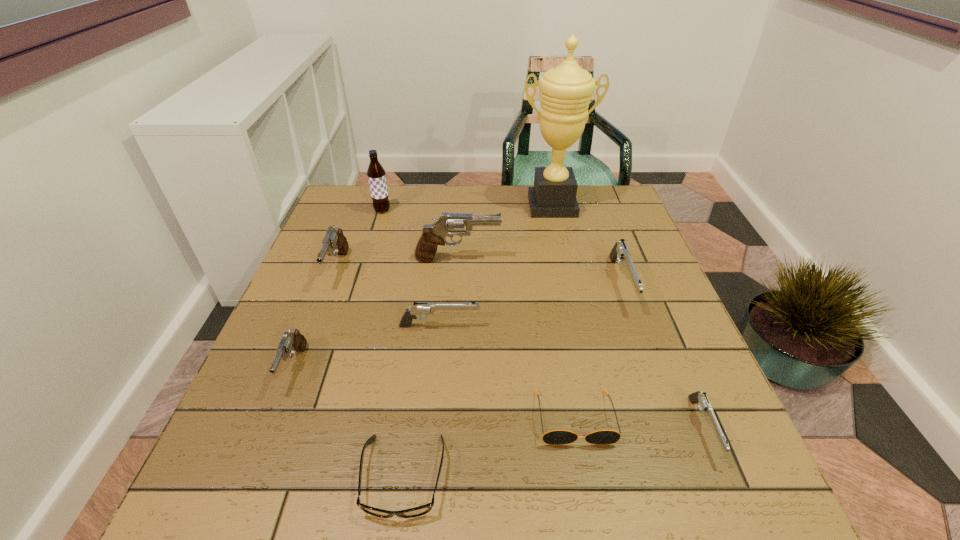
The image size is (960, 540). I want to click on free spot located at the barrel of the tallest pistol, so click(519, 259).

This screenshot has height=540, width=960. I want to click on vacant point located at the barrel of the seventh shortest object, so click(280, 418).

Find the location of `vacant position located 0.070m on the front-facing side of the biggest silver pistol`. vacant position located 0.070m on the front-facing side of the biggest silver pistol is located at coordinates (641, 340).

Find the location of a particular element. The image size is (960, 540). free region located at the barrel of the fifth farthest pistol is located at coordinates (260, 455).

Locate an element on the screen. The image size is (960, 540). blank space located on the front-facing side of the sixth farthest object is located at coordinates (592, 326).

I want to click on vacant space located on the front-facing side of the rightmost object, so click(x=731, y=495).

You are a GUI agent. You are given a task and a screenshot of the screen. Output one action in this format:
    pyautogui.click(x=<x>, y=<y>)
    Task: Click on the vacant space located on the front-facing side of the sunglasses
    The image size is (960, 540).
    Given the screenshot: What is the action you would take?
    pyautogui.click(x=593, y=521)

Find the location of a particular element. This screenshot has height=540, width=960. trophy cup situated at the far edge is located at coordinates (565, 91).

Where is `root beer present at the far edge`? The image size is (960, 540). root beer present at the far edge is located at coordinates (376, 175).

Locate an element on the screen. The image size is (960, 540). object situated at the near edge is located at coordinates (424, 509).